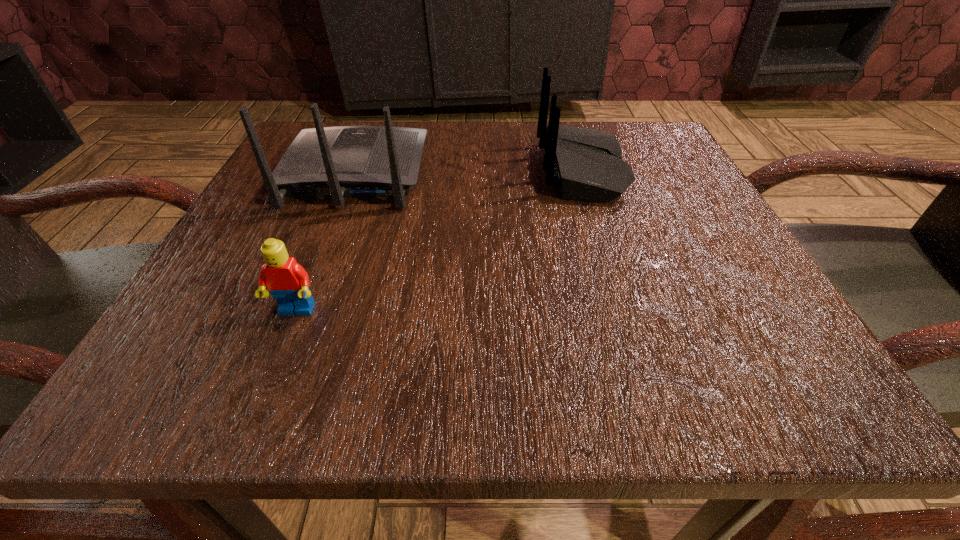
Identify the location of the left router. (345, 161).

I want to click on the rightmost object, so click(587, 164).

What are the coordinates of `the nearest object` in the screenshot? It's located at (287, 281).

This screenshot has height=540, width=960. I want to click on the shortest object, so click(287, 281).

Where is `blank area located on the front-facing side of the left router`? blank area located on the front-facing side of the left router is located at coordinates (372, 131).

The width and height of the screenshot is (960, 540). What are the coordinates of `blank space located on the front-facing side of the left router` in the screenshot? It's located at (373, 126).

Find the location of a particular element. Image resolution: width=960 pixels, height=540 pixels. vacant space positioned on the back of the right router is located at coordinates (440, 170).

I want to click on free spot located on the back of the right router, so click(x=362, y=170).

Locate an element on the screen. vacant space situated on the back of the right router is located at coordinates (372, 170).

The height and width of the screenshot is (540, 960). What are the coordinates of `blank space located on the face of the Lego` in the screenshot? It's located at (263, 395).